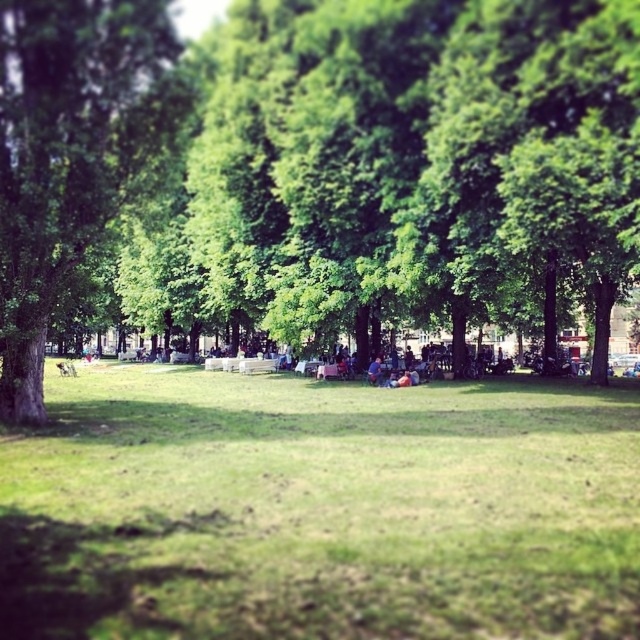
You are standing at the origin point in the park. Where is the green grassy field at center located in relation to your position?

The green grassy field at center is located at coordinates point (x=320, y=509) relative to your position.

You are standing at the entrance of the park and want to find the white plastic bench at center. According to the coordinates provided, where should you look to find it?

The white plastic bench at center is located at coordinates point (257, 365).

You are planning to set up a small tent in the park. The tent requires a space that is wider than the white plastic bench at center. Can the green grassy field at center accommodate the tent?

The green grassy field at center has a width larger than the white plastic bench at center, so yes, the tent can be accommodated there since the field is wider than the bench.